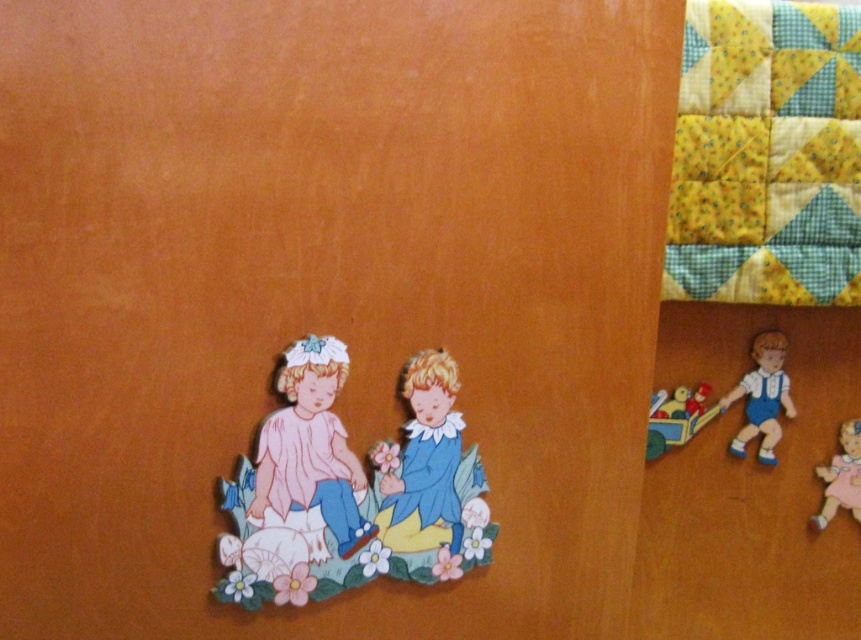
Question: Which object appears closest to the camera in this image?

Choices:
 (A) matte paper child at center
 (B) matte plastic toy train at lower right
 (C) matte white doll at right

Answer: (A)

Question: Can you confirm if matte white doll at right is positioned above matte plastic toy train at lower right?

Choices:
 (A) no
 (B) yes

Answer: (B)

Question: Is yellow-green patchwork quilt at upper right below pink fabric doll at lower right?

Choices:
 (A) no
 (B) yes

Answer: (A)

Question: Estimate the real-world distances between objects in this image. Which object is closer to the matte wooden children at lower left?

Choices:
 (A) matte white doll at right
 (B) matte plastic toy train at lower right
 (C) pink fabric doll at lower right
 (D) yellow-green patchwork quilt at upper right

Answer: (B)

Question: Which point appears closest to the camera in this image?

Choices:
 (A) (335, 449)
 (B) (438, 467)
 (C) (429, 460)

Answer: (A)

Question: Is yellow-green patchwork quilt at upper right thinner than matte plastic toy train at lower right?

Choices:
 (A) no
 (B) yes

Answer: (A)